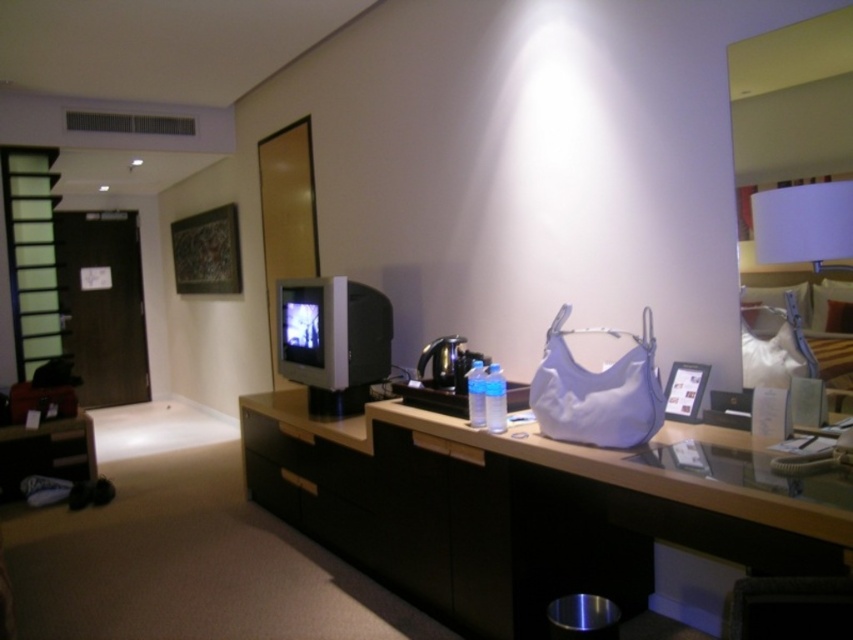
You are a guest in this room and want to place your keys on the matte black counter top at center. However, there is a black matte drawer at center nearby. Which object should you place your keys on to ensure they are on the correct surface?

You should place your keys on the matte black counter top at center because it is the surface to the right of the black matte drawer at center, as specified in the description.

You are a guest in the hotel room and want to place your phone on a flat surface. Which object between the white matte lampshade at upper right and the black matte drawer at center would be more suitable for placing your phone?

The black matte drawer at center is more suitable for placing your phone because the white matte lampshade at upper right is above it and might not provide a stable flat surface.